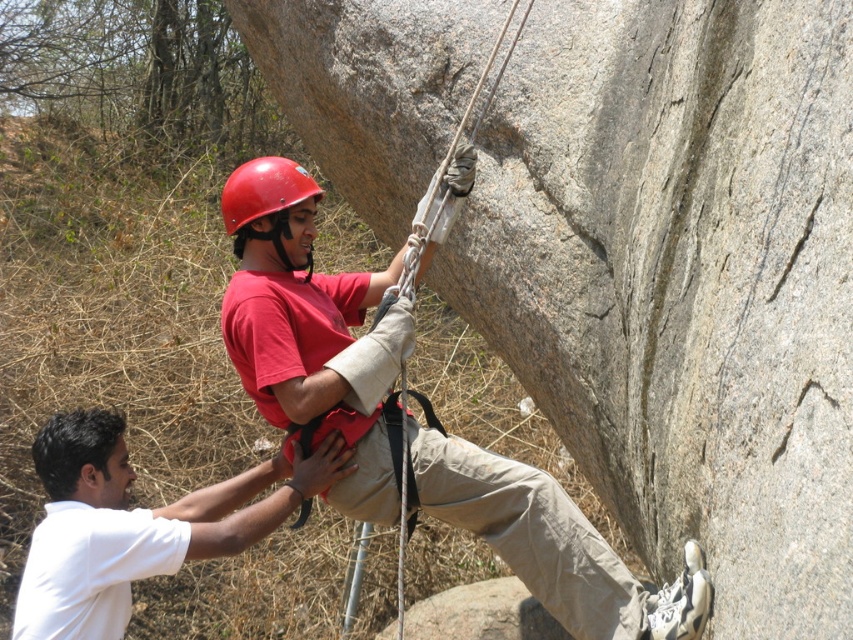
Who is lower down, white matte shirt at lower left or matte red helmet at center?

white matte shirt at lower left is lower down.

Is point (126, 589) behind point (286, 260)?

Yes, it is.

Where is `white matte shirt at lower left`? white matte shirt at lower left is located at coordinates (136, 524).

Does point (229, 330) come behind point (280, 224)?

No, it is not.

Is point (357, 314) positioned before point (263, 182)?

No, it is not.

Where is `matte red helmet at upper center`? The width and height of the screenshot is (853, 640). matte red helmet at upper center is located at coordinates [x=302, y=326].

Who is more distant from viewer, (x=527, y=497) or (x=94, y=456)?

The point (x=94, y=456) is more distant.

Is point (322, 326) more distant than point (64, 422)?

No, it is in front of (64, 422).

Identify the location of matte red helmet at upper center. (302, 326).